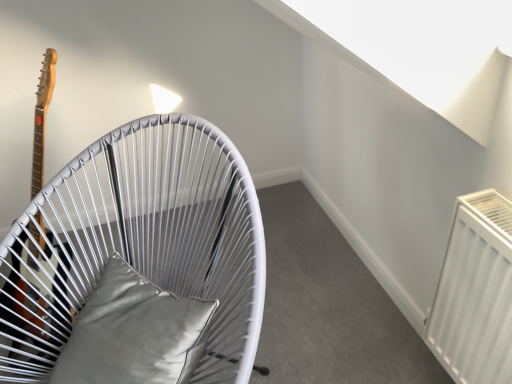
Where is `white woven chair at left`? The image size is (512, 384). white woven chair at left is located at coordinates (139, 243).

Describe the element at coordinates (139, 243) in the screenshot. The image size is (512, 384). I see `white woven chair at left` at that location.

Identify the location of white woven chair at left. Image resolution: width=512 pixels, height=384 pixels. (139, 243).